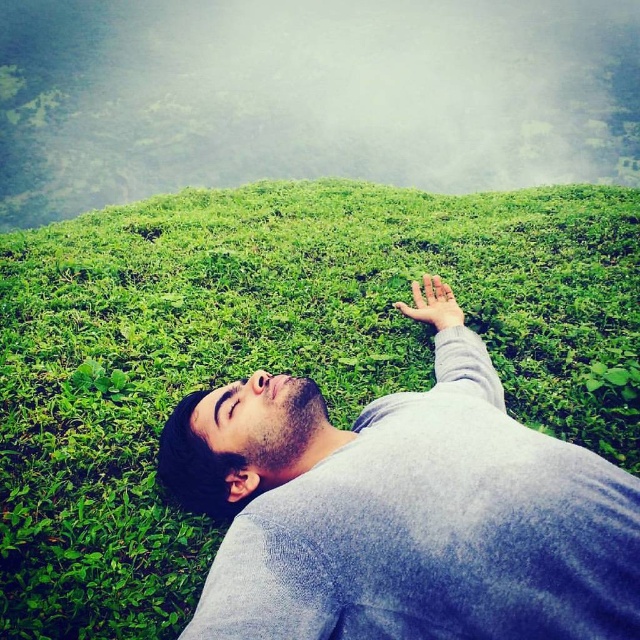
Question: Which point appears closest to the camera in this image?

Choices:
 (A) (451, 301)
 (B) (273, 572)

Answer: (B)

Question: Which point appears closest to the camera in this image?

Choices:
 (A) (573, 460)
 (B) (420, 305)

Answer: (A)

Question: Does gray cotton shirt at center have a larger size compared to matte skin hand at upper center?

Choices:
 (A) no
 (B) yes

Answer: (B)

Question: In this image, where is gray cotton shirt at center located relative to matte skin hand at upper center?

Choices:
 (A) right
 (B) left

Answer: (B)

Question: Is gray cotton shirt at center closer to camera compared to matte skin hand at upper center?

Choices:
 (A) yes
 (B) no

Answer: (A)

Question: Which of the following is the farthest from the observer?

Choices:
 (A) gray cotton shirt at center
 (B) matte skin hand at upper center

Answer: (B)